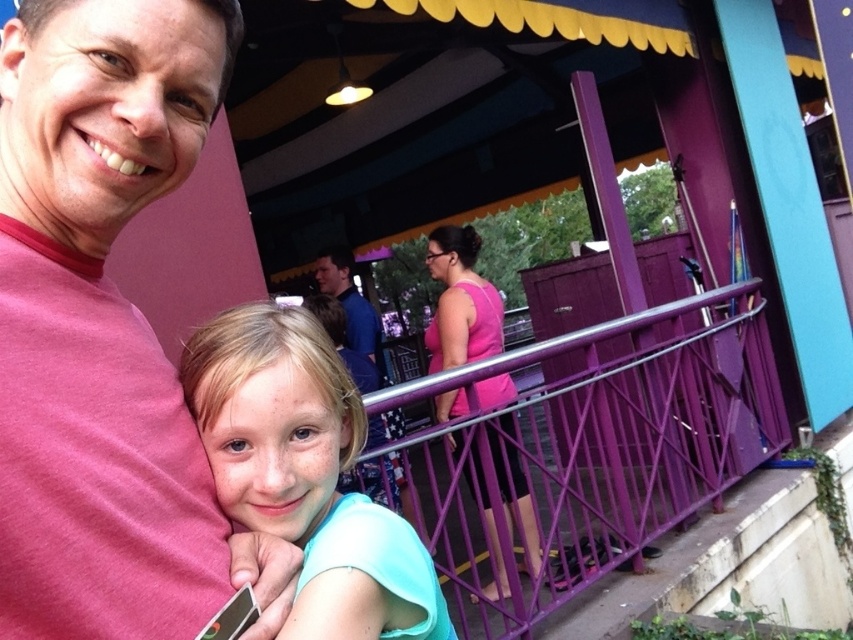
Question: Can you confirm if matte pink shirt at left is thinner than purple metallic railing at center?

Choices:
 (A) yes
 (B) no

Answer: (A)

Question: Which of the following is the closest to the observer?

Choices:
 (A) [445, 554]
 (B) [383, 584]
 (C) [526, 520]
 (D) [53, 113]

Answer: (D)

Question: Estimate the real-world distances between objects in this image. Which object is closer to the pink fabric dress at center?

Choices:
 (A) light blue fabric at center
 (B) matte pink shirt at left

Answer: (A)

Question: Observing the image, what is the correct spatial positioning of matte pink shirt at left in reference to purple metallic railing at center?

Choices:
 (A) right
 (B) left

Answer: (B)

Question: Based on their relative distances, which object is farther from the pink fabric dress at center?

Choices:
 (A) light blue fabric at center
 (B) purple metallic railing at center

Answer: (A)

Question: Observing the image, what is the correct spatial positioning of light blue fabric at center in reference to pink fabric dress at center?

Choices:
 (A) above
 (B) below

Answer: (A)